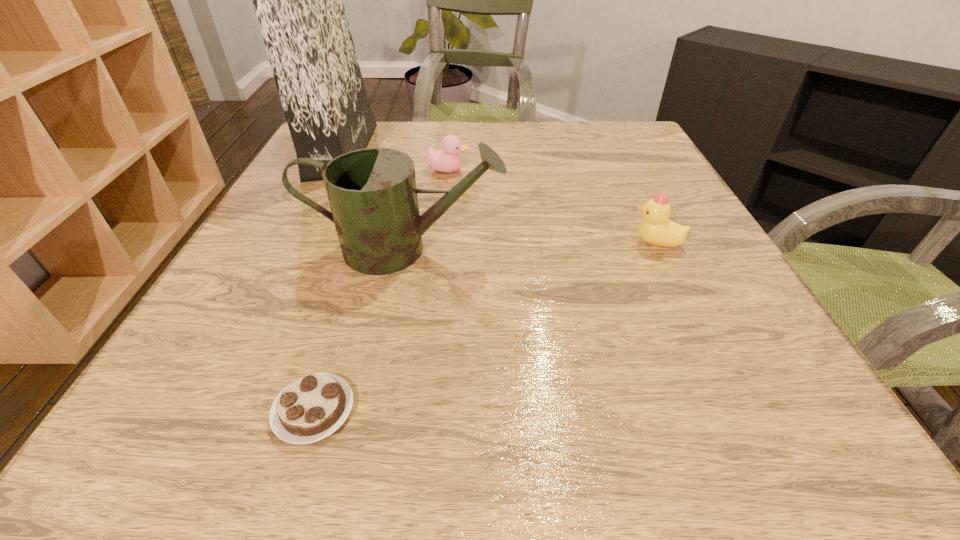
This screenshot has height=540, width=960. I want to click on blank region between the left duckling and the chocolate cake, so click(x=381, y=290).

At what (x,y) coordinates should I click in order to perform the action: click on vacant space that's between the rightmost object and the tallest object. Please return your answer as a coordinate pair (x, y). This screenshot has height=540, width=960. Looking at the image, I should click on (499, 197).

The width and height of the screenshot is (960, 540). What are the coordinates of `vacant point located between the shopping bag and the nearest object` in the screenshot? It's located at (327, 280).

Locate an element on the screen. Image resolution: width=960 pixels, height=540 pixels. vacant region between the nearer duckling and the farther duckling is located at coordinates (552, 206).

The image size is (960, 540). What are the coordinates of `object that stands as the second closest to the right duckling` in the screenshot? It's located at (448, 160).

Identify which object is located as the third nearest to the shopping bag. Please provide its 2D coordinates. Your answer should be formatted as a tuple, i.e. [(x, y)], where the tuple contains the x and y coordinates of a point satisfying the conditions above.

[(309, 409)]

Where is `free location that satisfies the following two spatial constraints: 1. on the front-facing side of the rightmost object; 2. on the front side of the chocolate cake`? The height and width of the screenshot is (540, 960). free location that satisfies the following two spatial constraints: 1. on the front-facing side of the rightmost object; 2. on the front side of the chocolate cake is located at coordinates (737, 410).

I want to click on free location that satisfies the following two spatial constraints: 1. on the front of the shopping bag with the design; 2. on the right side of the chocolate cake, so click(x=209, y=410).

Locate an element on the screen. vacant space that satisfies the following two spatial constraints: 1. on the front-facing side of the farther duckling; 2. on the front side of the nearest object is located at coordinates (420, 410).